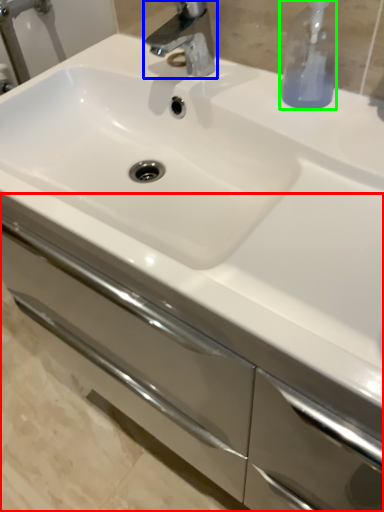
Question: Which is farther away from bathroom cabinet (highlighted by a red box)? tap (highlighted by a blue box) or soap dispenser (highlighted by a green box)?

Choices:
 (A) tap
 (B) soap dispenser

Answer: (A)